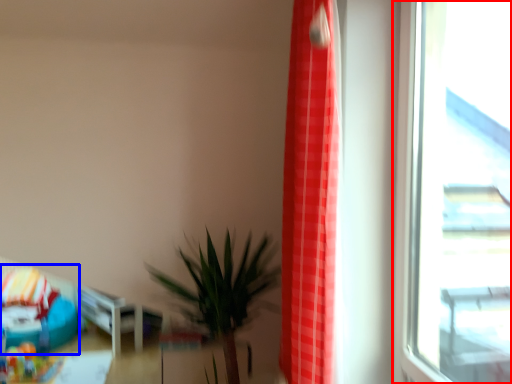
Question: Which object appears farthest to the camera in this image, window (highlighted by a red box) or bean bag chair (highlighted by a blue box)?

Choices:
 (A) window
 (B) bean bag chair

Answer: (B)